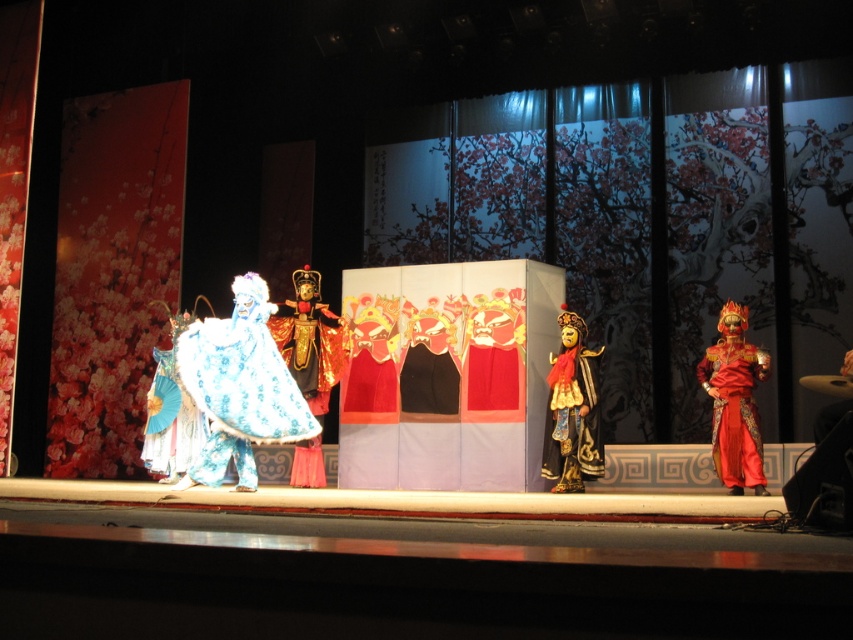
Which is behind, point (727, 474) or point (572, 442)?

Point (572, 442)

Can you confirm if shiny red costume at right is positioned below gold metallic mask at center?

Indeed, shiny red costume at right is positioned under gold metallic mask at center.

At what (x,y) coordinates should I click in order to perform the action: click on shiny red costume at right. Please return your answer as a coordinate pair (x, y). This screenshot has width=853, height=640. Looking at the image, I should click on (734, 401).

Is blue satin robe at center in front of gold textured mask at center?

Yes, it is.

Can you confirm if blue satin robe at center is bigger than gold textured mask at center?

Yes, blue satin robe at center is bigger than gold textured mask at center.

I want to click on blue satin robe at center, so click(x=239, y=387).

Between shiny red costume at right and shiny blue fabric at center, which one appears on the right side from the viewer's perspective?

shiny red costume at right

Does shiny red costume at right lie behind shiny blue fabric at center?

No, shiny red costume at right is closer to the viewer.

Which is behind, point (714, 349) or point (166, 422)?

The point (166, 422) is behind.

At what (x,y) coordinates should I click in order to perform the action: click on shiny red costume at right. Please return your answer as a coordinate pair (x, y). This screenshot has height=640, width=853. Looking at the image, I should click on (734, 401).